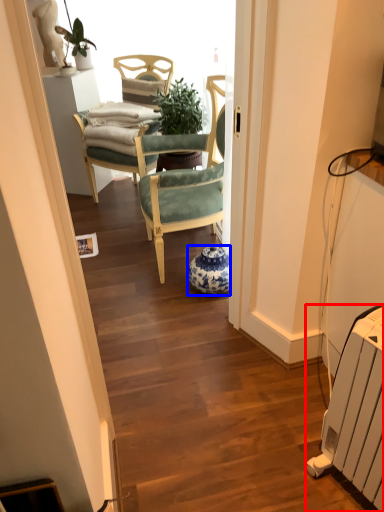
Question: Among these objects, which one is nearest to the camera, radiator (highlighted by a red box) or vase (highlighted by a blue box)?

Choices:
 (A) radiator
 (B) vase

Answer: (A)